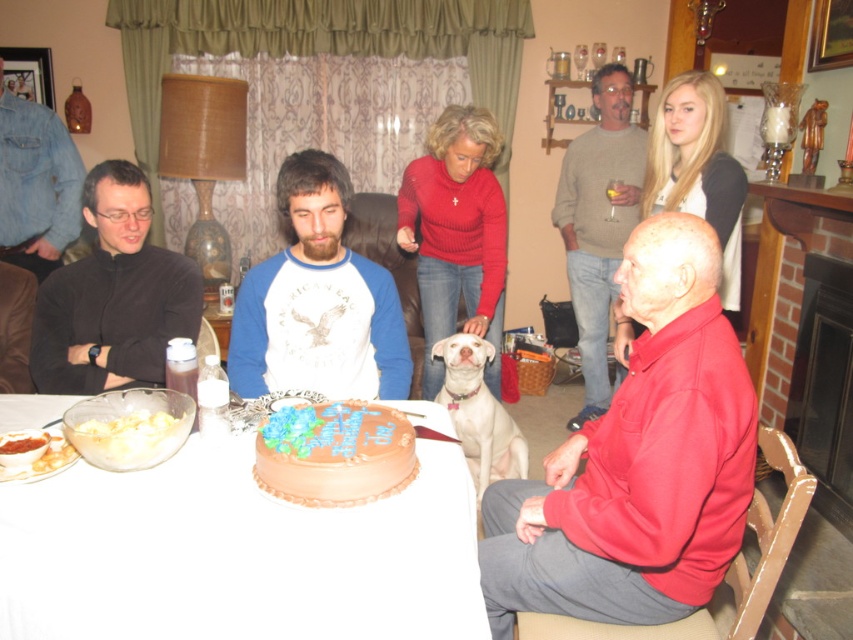
You are organizing a coat rack for guests at the celebration. You have a matte gray sweater at center and a denim jacket at left. Which item requires a wider hanger?

The matte gray sweater at center requires a wider hanger since its width is larger than the denim jacket at left.

In the scene shown: You are at the point labeled point (616, 122) and want to walk to the cake. Is the point labeled point (495, 570) between you and the cake?

Yes, the point labeled point (495, 570) is between you and the cake because it is in front of point (616, 122).